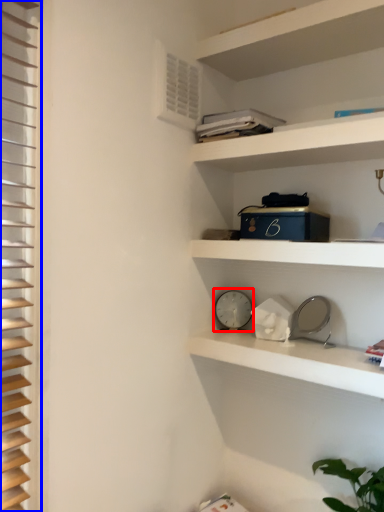
Question: Which of the following is the farthest to the observer, clock (highlighted by a red box) or shutter (highlighted by a blue box)?

Choices:
 (A) clock
 (B) shutter

Answer: (A)